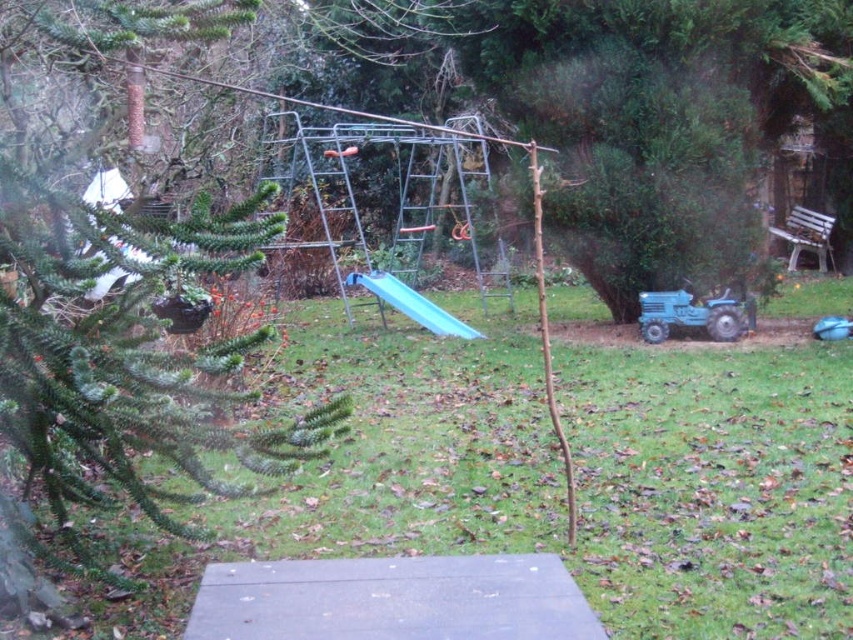
Who is higher up, green grass at center or blue plastic slide at center?

blue plastic slide at center is above.

Which is in front, point (422, 381) or point (416, 298)?

Point (422, 381)

Between point (593, 456) and point (416, 294), which one is positioned in front?

Positioned in front is point (593, 456).

Locate an element on the screen. This screenshot has height=640, width=853. green grass at center is located at coordinates (709, 484).

Can you confirm if blue matte tractor at lower right is thinner than blue plastic slide at center?

Yes.

This screenshot has width=853, height=640. I want to click on blue matte tractor at lower right, so click(x=691, y=314).

Which of these two, green grass at center or blue matte tractor at lower right, stands shorter?

green grass at center is shorter.

Is green grass at center bigger than blue matte tractor at lower right?

No.

This screenshot has width=853, height=640. Find the location of `green grass at center`. green grass at center is located at coordinates (709, 484).